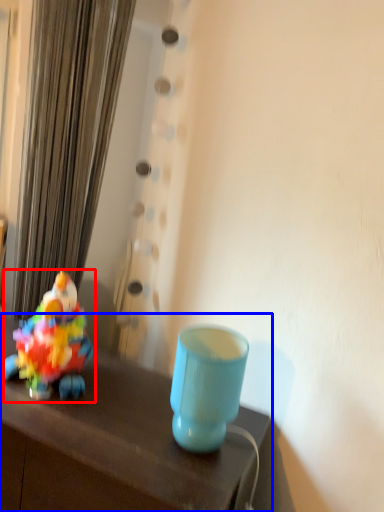
Question: Which object appears closest to the camera in this image, toy (highlighted by a red box) or table (highlighted by a blue box)?

Choices:
 (A) toy
 (B) table

Answer: (B)